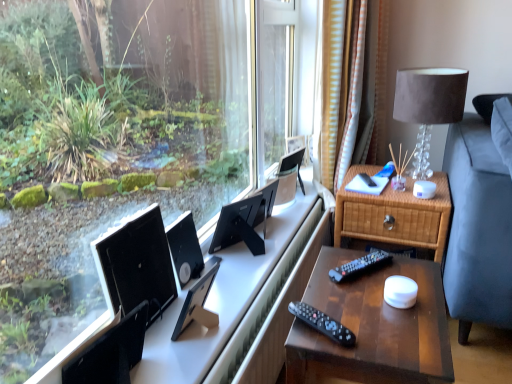
This screenshot has width=512, height=384. Identify the location of black plastic computer desk at center. (220, 302).

What do you see at coordinates (373, 326) in the screenshot?
I see `wooden nightstand at right, which is the second nightstand in back-to-front order` at bounding box center [373, 326].

This screenshot has height=384, width=512. Find the location of `woven wood nightstand at right, which appears as the 1th nightstand when viewed from the back`. woven wood nightstand at right, which appears as the 1th nightstand when viewed from the back is located at coordinates (394, 214).

You are a GUI agent. You are given a task and a screenshot of the screen. Output one action in this format:
    pyautogui.click(x=<x>, y=<y>)
    Task: Click on the black plastic remote at right
    The image size is (512, 384).
    Given the screenshot: What is the action you would take?
    pyautogui.click(x=367, y=179)

Does black plastic remote control at lower center, marked as the second remote control in a bottom-to-top arrangement, have a lesser height compared to black matte computer monitor at center, which is counted as the third computer monitor, starting from the front?

Yes, black plastic remote control at lower center, marked as the second remote control in a bottom-to-top arrangement, is shorter than black matte computer monitor at center, which is counted as the third computer monitor, starting from the front.

Is black plastic remote control at lower center, which ranks as the 2th remote control in left-to-right order, outside of black matte computer monitor at center, arranged as the 2th computer monitor when viewed from the back?

black plastic remote control at lower center, which ranks as the 2th remote control in left-to-right order, is positioned outside black matte computer monitor at center, arranged as the 2th computer monitor when viewed from the back.

Can you see black plastic remote control at lower center, which is the first remote control in back-to-front order, touching black matte computer monitor at center, which is counted as the third computer monitor, starting from the front?

They are not placed beside each other.

Consider the image. From a real-world perspective, is black plastic remote control at lower center, which ranks as the 2th remote control in left-to-right order, physically located above or below black matte computer monitor at center, arranged as the 2th computer monitor when viewed from the back?

Clearly, from a real-world perspective, black plastic remote control at lower center, which ranks as the 2th remote control in left-to-right order, is above black matte computer monitor at center, arranged as the 2th computer monitor when viewed from the back.

Is point (184, 306) closer to viewer compared to point (420, 74)?

Yes, point (184, 306) is in front of point (420, 74).

Is matte black monitor at center, which appears as the second computer monitor when viewed from the front, oriented away from satin brown lampshade at upper right?

No, matte black monitor at center, which appears as the second computer monitor when viewed from the front,'s orientation is not away from satin brown lampshade at upper right.

From the satin brown lampshade at upper right, count 3rd computer monitors forward and point to it. Please provide its 2D coordinates.

[(198, 303)]

From the image's perspective, who appears lower, matte black monitor at center, marked as the 3th computer monitor in a back-to-front arrangement, or satin brown lampshade at upper right?

matte black monitor at center, marked as the 3th computer monitor in a back-to-front arrangement, is shown below in the image.

Does black plastic remote at right have a lesser width compared to wooden nightstand at right, which is the second nightstand in back-to-front order?

Yes.

Is black plastic remote at right outside of wooden nightstand at right, which is the second nightstand in back-to-front order?

black plastic remote at right is positioned outside wooden nightstand at right, which is the second nightstand in back-to-front order.

Who is taller, black plastic remote at right or wooden nightstand at right, acting as the first nightstand starting from the front?

With more height is wooden nightstand at right, acting as the first nightstand starting from the front.

Is black plastic remote at right smaller than wooden nightstand at right, which is the second nightstand in back-to-front order?

Correct, black plastic remote at right occupies less space than wooden nightstand at right, which is the second nightstand in back-to-front order.

From the picture: In terms of height, does black matte computer monitor at center, the first computer monitor positioned from the front, look taller or shorter compared to wooden nightstand at right, which is the second nightstand in back-to-front order?

black matte computer monitor at center, the first computer monitor positioned from the front, is shorter than wooden nightstand at right, which is the second nightstand in back-to-front order.

Which computer monitor is the 1st one when counting from the back of the wooden nightstand at right, acting as the first nightstand starting from the front? Please provide its 2D coordinates.

[(137, 265)]

From the image's perspective, which one is positioned higher, black matte computer monitor at center, the fourth computer monitor positioned from the back, or wooden nightstand at right, which is the second nightstand in back-to-front order?

black matte computer monitor at center, the fourth computer monitor positioned from the back.

Between black matte computer monitor at center, the first computer monitor positioned from the front, and wooden nightstand at right, which is the second nightstand in back-to-front order, which one has larger width?

wooden nightstand at right, which is the second nightstand in back-to-front order.

Considering the sizes of black matte computer monitor at center, arranged as the 1th computer monitor when viewed from the back, and striped fabric curtain at right in the image, is black matte computer monitor at center, arranged as the 1th computer monitor when viewed from the back, bigger or smaller than striped fabric curtain at right?

In the image, black matte computer monitor at center, arranged as the 1th computer monitor when viewed from the back, appears to be smaller than striped fabric curtain at right.

Looking at this image, which is behind, black matte computer monitor at center, arranged as the 1th computer monitor when viewed from the back, or striped fabric curtain at right?

striped fabric curtain at right is further away from the camera.

Is point (248, 200) closer to camera compared to point (340, 153)?

Yes, it is.

Considering the positions of objects black matte computer monitor at center, arranged as the 1th computer monitor when viewed from the back, and striped fabric curtain at right in the image provided, who is more to the right, black matte computer monitor at center, arranged as the 1th computer monitor when viewed from the back, or striped fabric curtain at right?

striped fabric curtain at right.

Is black matte computer monitor at center, the first computer monitor positioned from the front, further to the viewer compared to striped fabric curtain at right?

No, black matte computer monitor at center, the first computer monitor positioned from the front, is closer to the camera.

Based on the photo, which object is positioned more to the right, black matte computer monitor at center, the first computer monitor positioned from the front, or striped fabric curtain at right?

striped fabric curtain at right is more to the right.

Is black matte computer monitor at center, the fourth computer monitor positioned from the back, not near striped fabric curtain at right?

Yes.

Can you confirm if black matte computer monitor at center, the first computer monitor positioned from the front, is taller than striped fabric curtain at right?

Incorrect, the height of black matte computer monitor at center, the first computer monitor positioned from the front, is not larger of that of striped fabric curtain at right.

From a real-world perspective, does wooden nightstand at right, acting as the first nightstand starting from the front, sit lower than black matte swivel chair at lower left?

Correct, in the physical world, wooden nightstand at right, acting as the first nightstand starting from the front, is lower than black matte swivel chair at lower left.

Looking at this image, from the image's perspective, between wooden nightstand at right, acting as the first nightstand starting from the front, and black matte swivel chair at lower left, who is located below?

wooden nightstand at right, acting as the first nightstand starting from the front, appears lower in the image.

Locate an element on the screen. swivel chair that appears in front of the wooden nightstand at right, which is the second nightstand in back-to-front order is located at coordinates (111, 352).

Where is `remote control that is the 1st one when counting forward from the black matte computer monitor at center, which is counted as the third computer monitor, starting from the front`? The width and height of the screenshot is (512, 384). remote control that is the 1st one when counting forward from the black matte computer monitor at center, which is counted as the third computer monitor, starting from the front is located at coordinates (360, 265).

Identify the location of table lamp that appears behind the matte black monitor at center, marked as the 3th computer monitor in a back-to-front arrangement. (428, 106).

Based on their spatial positions, is satin brown lampshade at upper right or black plastic remote at right further from black plastic computer desk at center?

Based on the image, satin brown lampshade at upper right appears to be further to black plastic computer desk at center.

Considering their positions, is woven wood nightstand at right, which appears as the 1th nightstand when viewed from the back, positioned further to black plastic computer desk at center than black plastic remote control at lower center, placed as the first remote control when sorted from left to right?

black plastic remote control at lower center, placed as the first remote control when sorted from left to right, is positioned further to the anchor black plastic computer desk at center.

Based on their spatial positions, is woven wood nightstand at right, marked as the 2th nightstand in a front-to-back arrangement, or matte black monitor at center, marked as the 3th computer monitor in a back-to-front arrangement, closer to black matte swivel chair at lower left?

The object closer to black matte swivel chair at lower left is matte black monitor at center, marked as the 3th computer monitor in a back-to-front arrangement.

Estimate the real-world distances between objects in this image. Which object is further from black matte swivel chair at lower left, black matte computer monitor at center, which is counted as the third computer monitor, starting from the front, or black matte computer monitor at center, the fourth computer monitor positioned from the back?

black matte computer monitor at center, which is counted as the third computer monitor, starting from the front, is positioned further to the anchor black matte swivel chair at lower left.

Estimate the real-world distances between objects in this image. Which object is further from black plastic computer desk at center, black plastic remote control at lower center, which is the second remote control from top to bottom, or wooden nightstand at right, acting as the first nightstand starting from the front?

The object further to black plastic computer desk at center is black plastic remote control at lower center, which is the second remote control from top to bottom.

Looking at the image, which one is located further to matte black monitor at center, which appears as the second computer monitor when viewed from the front, woven wood nightstand at right, which appears as the 1th nightstand when viewed from the back, or black matte computer monitor at center, positioned as the 4th computer monitor in front-to-back order?

woven wood nightstand at right, which appears as the 1th nightstand when viewed from the back, is positioned further to the anchor matte black monitor at center, which appears as the second computer monitor when viewed from the front.

Based on their spatial positions, is black plastic remote control at lower center, which is the second remote control from top to bottom, or black plastic remote at right further from wooden nightstand at right, acting as the first nightstand starting from the front?

The object further to wooden nightstand at right, acting as the first nightstand starting from the front, is black plastic remote at right.

Considering their positions, is striped fabric curtain at right positioned closer to satin brown lampshade at upper right than matte black monitor at center, marked as the 3th computer monitor in a back-to-front arrangement?

striped fabric curtain at right is closer to satin brown lampshade at upper right.

You are a GUI agent. You are given a task and a screenshot of the screen. Output one action in this format:
    pyautogui.click(x=<x>, y=<y>)
    Task: Click on the remote control between black matte computer monitor at center, which is counted as the third computer monitor, starting from the front, and black plastic remote control at lower center, which appears as the 1th remote control when viewed from the top, from left to right
    The image size is (512, 384).
    Given the screenshot: What is the action you would take?
    pyautogui.click(x=322, y=323)

You are a GUI agent. You are given a task and a screenshot of the screen. Output one action in this format:
    pyautogui.click(x=<x>, y=<y>)
    Task: Click on the table lamp between black plastic computer desk at center and striped fabric curtain at right along the z-axis
    The image size is (512, 384).
    Given the screenshot: What is the action you would take?
    pyautogui.click(x=428, y=106)

Image resolution: width=512 pixels, height=384 pixels. I want to click on table lamp between black plastic remote control at lower center, placed as the first remote control when sorted from left to right, and woven wood nightstand at right, which appears as the 1th nightstand when viewed from the back, along the z-axis, so click(428, 106).

The height and width of the screenshot is (384, 512). Find the location of `computer desk between black matte computer monitor at center, the fourth computer monitor positioned from the back, and satin brown lampshade at upper right from left to right`. computer desk between black matte computer monitor at center, the fourth computer monitor positioned from the back, and satin brown lampshade at upper right from left to right is located at coordinates (220, 302).